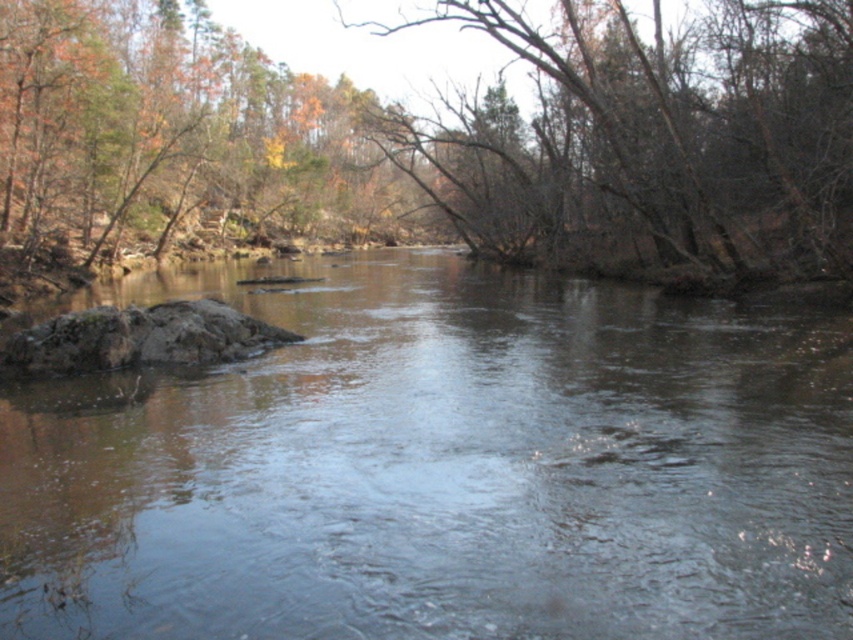
Does brown bark tree at upper right come in front of mossy rock at center-left?

No, brown bark tree at upper right is behind mossy rock at center-left.

Who is positioned more to the right, brown bark tree at upper right or mossy rock at center-left?

Positioned to the right is brown bark tree at upper right.

Between point (523, 211) and point (195, 307), which one is positioned in front?

Point (195, 307) is in front.

Where is `brown bark tree at upper right`? This screenshot has width=853, height=640. brown bark tree at upper right is located at coordinates (653, 141).

Does brown smooth rock at left lie in front of brown bark tree at upper right?

Yes, brown smooth rock at left is in front of brown bark tree at upper right.

Which of these two, brown smooth rock at left or brown bark tree at upper right, stands shorter?

brown smooth rock at left

Who is more distant from viewer, (x=750, y=465) or (x=689, y=40)?

The point (x=689, y=40) is behind.

Find the location of `brown smooth rock at left`. brown smooth rock at left is located at coordinates (440, 467).

Identify the location of brown smooth rock at left. (440, 467).

From the picture: Is brown smooth rock at left wider than mossy rock at center-left?

Yes.

Does point (456, 257) lie in front of point (97, 310)?

No, it is not.

The height and width of the screenshot is (640, 853). Identify the location of brown smooth rock at left. (440, 467).